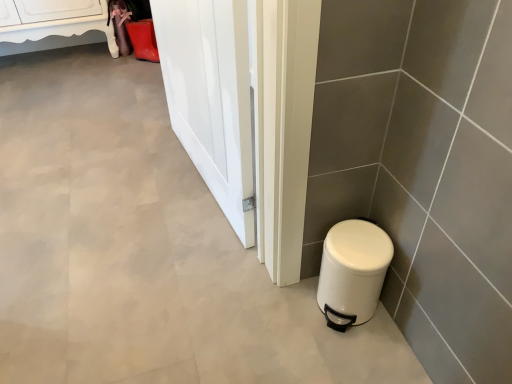
The height and width of the screenshot is (384, 512). Find the location of `vacant space situated on the left part of white glossy door at center`. vacant space situated on the left part of white glossy door at center is located at coordinates (108, 177).